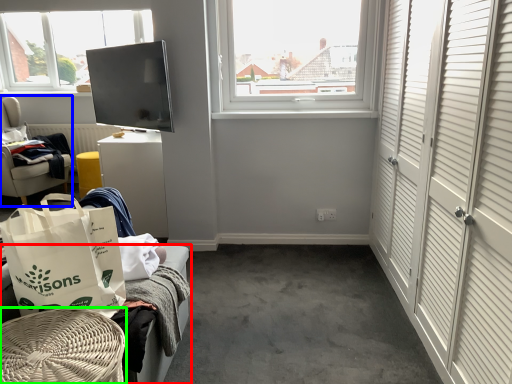
Question: Estimate the real-world distances between objects in this image. Which object is closer to furniture (highlighted by a red box), furniture (highlighted by a blue box) or furniture (highlighted by a green box)?

Choices:
 (A) furniture
 (B) furniture

Answer: (B)